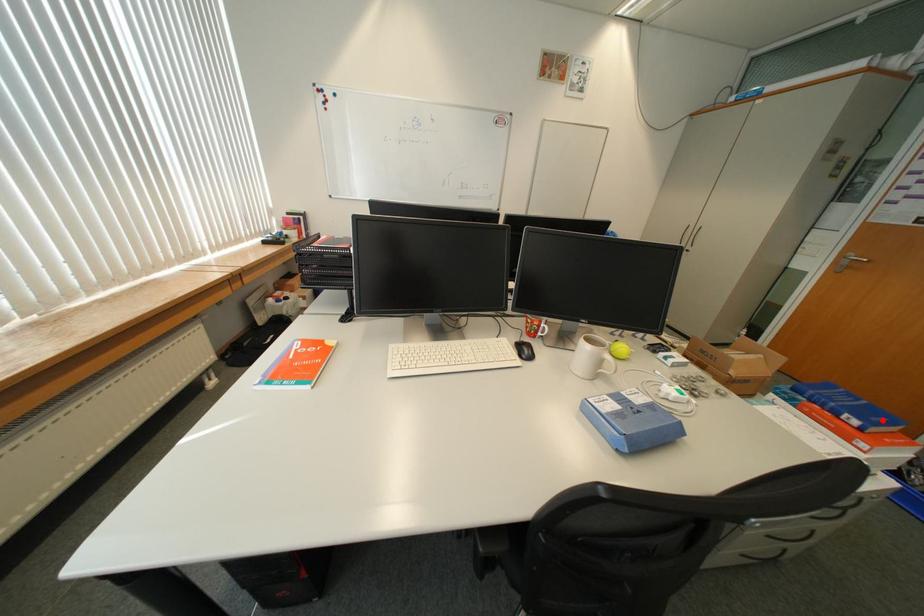
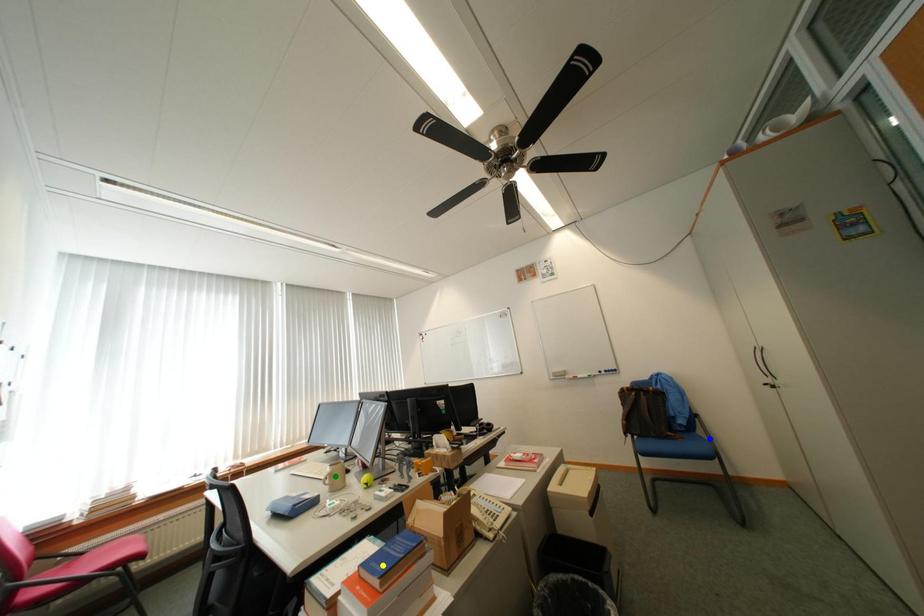
Question: I am providing you with two images of the same scene from different viewpoints. A red point is marked on the first image. You are given multiple points on the second image. Which mark in image 2 goes with the point in image 1?

Choices:
 (A) blue point
 (B) yellow point
 (C) green point

Answer: (B)